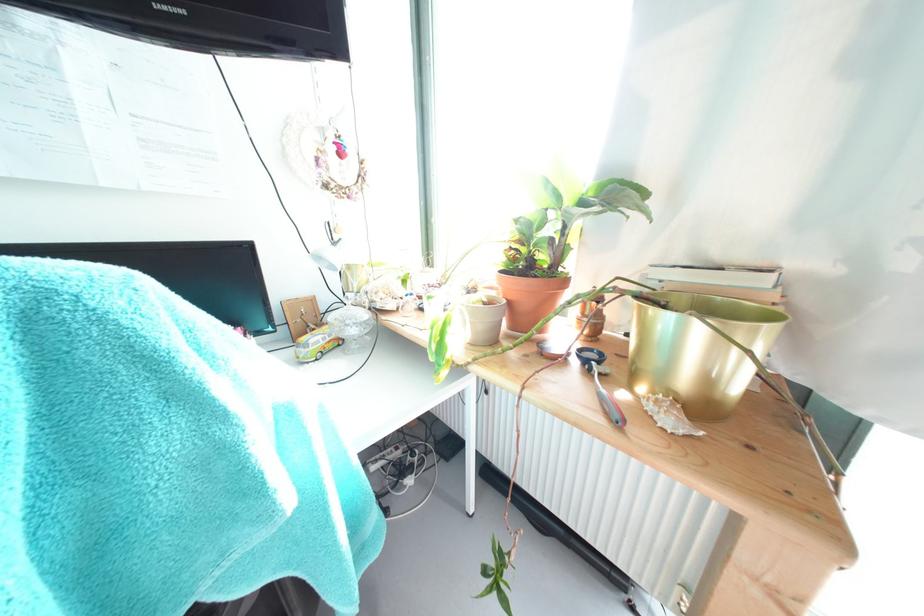
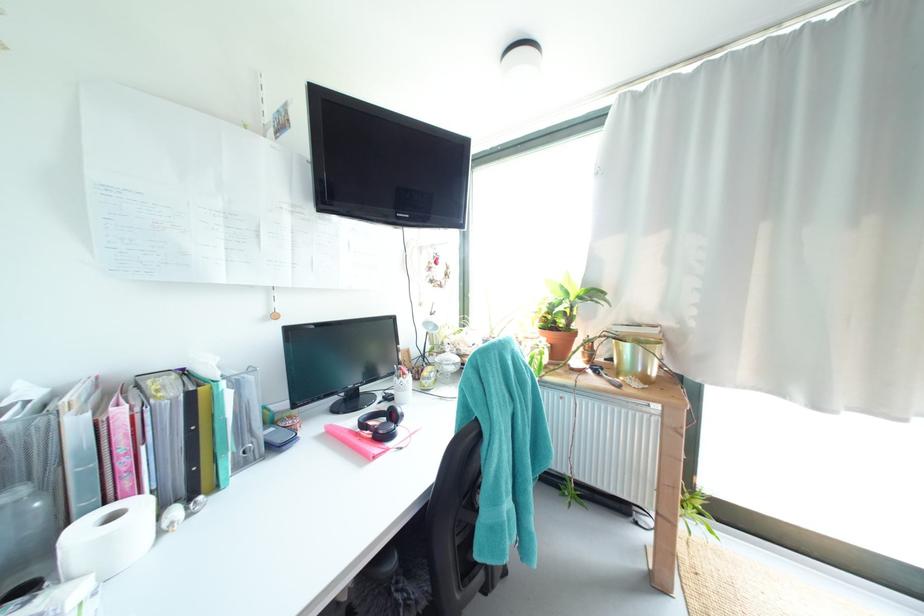
The point at (560, 241) is marked in the first image. Where is the corresponding point in the second image?

(573, 315)